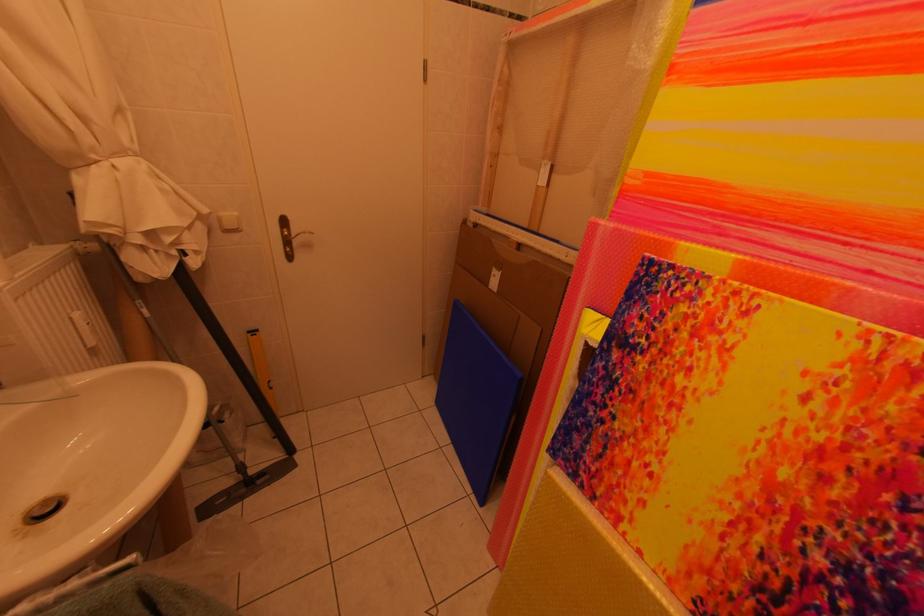
Where would you push the white light switch? Please return your answer as a coordinate pair (x, y).

(228, 222)